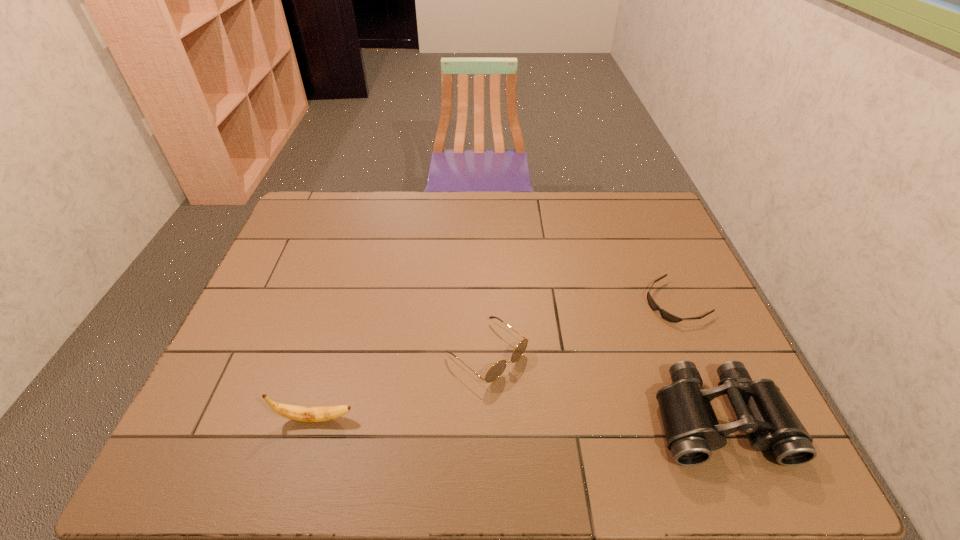
Locate an element on the screen. This screenshot has height=540, width=960. vacant space positioned 0.210m on the front-facing side of the shorter sunglasses is located at coordinates (598, 347).

Identify the location of free space located 0.340m on the front-facing side of the shorter sunglasses. This screenshot has width=960, height=540. (559, 370).

You are a GUI agent. You are given a task and a screenshot of the screen. Output one action in this format:
    pyautogui.click(x=<x>, y=<y>)
    Task: Click on the free region located 0.300m on the front-facing side of the shorter sunglasses
    This screenshot has width=960, height=540.
    Given the screenshot: What is the action you would take?
    pyautogui.click(x=571, y=363)

Find the location of a particular element. The image size is (960, 540). banana at the near edge is located at coordinates (298, 413).

At what (x,y) coordinates should I click in order to perform the action: click on binoculars present at the near edge. Please return your answer as a coordinate pair (x, y). Looking at the image, I should click on (692, 431).

You are a GUI agent. You are given a task and a screenshot of the screen. Output one action in this format:
    pyautogui.click(x=<x>, y=<y>)
    Task: Click on the sunglasses located at the near edge
    
    Given the screenshot: What is the action you would take?
    pyautogui.click(x=497, y=369)

This screenshot has height=540, width=960. I want to click on binoculars located in the right edge section of the desktop, so click(692, 431).

This screenshot has width=960, height=540. In order to click on sunglasses that is positioned at the right edge in this screenshot , I will do `click(665, 315)`.

Image resolution: width=960 pixels, height=540 pixels. In order to click on object situated at the near right corner in this screenshot , I will do (692, 431).

Locate an element on the screen. This screenshot has width=960, height=540. free space at the far edge of the desktop is located at coordinates (540, 206).